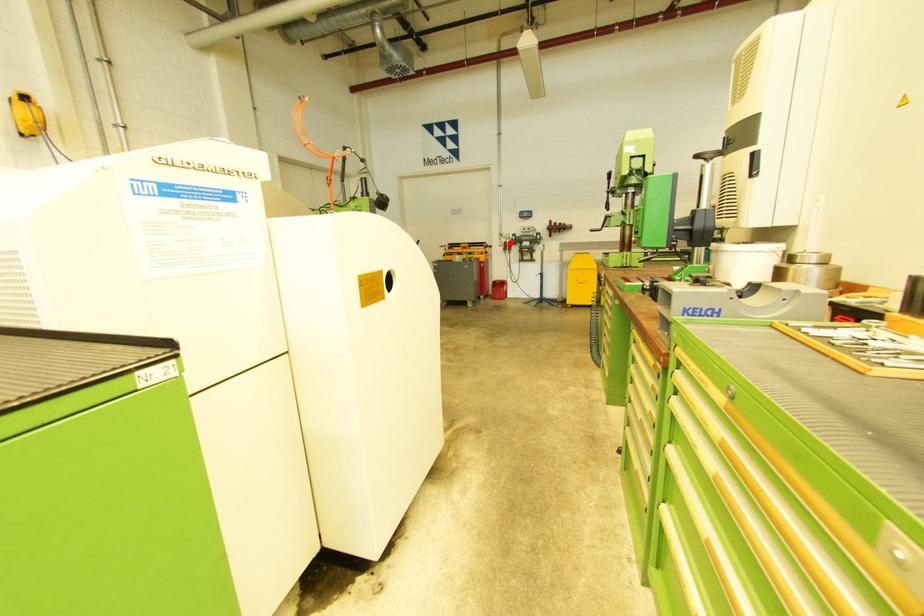
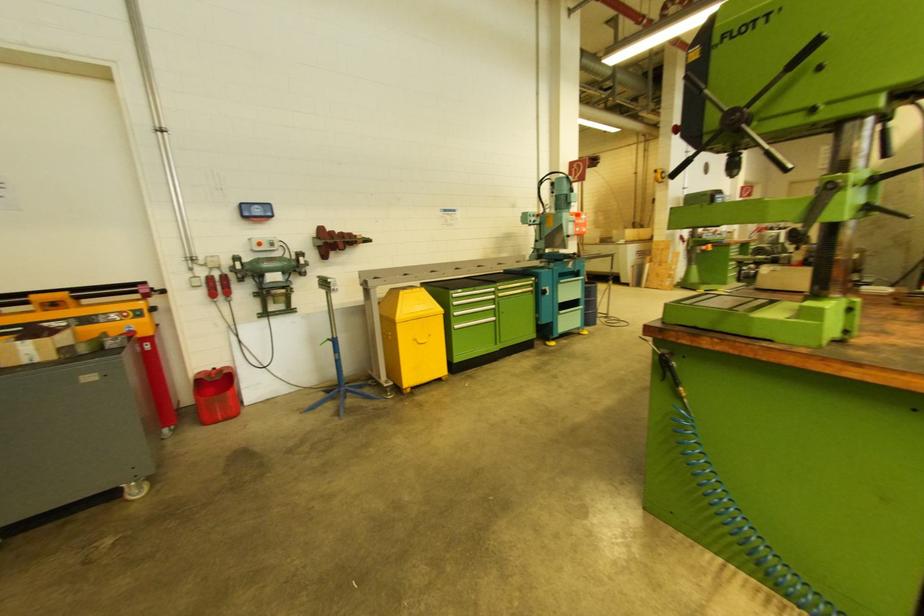
Locate, in the second image, the point that corresponds to the highlighted location in the first image.

(219, 276)